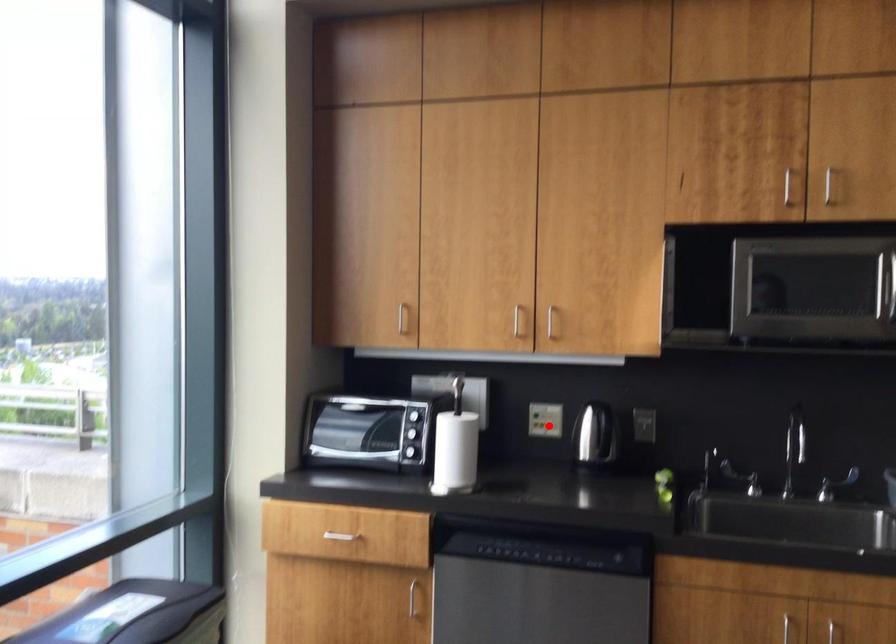
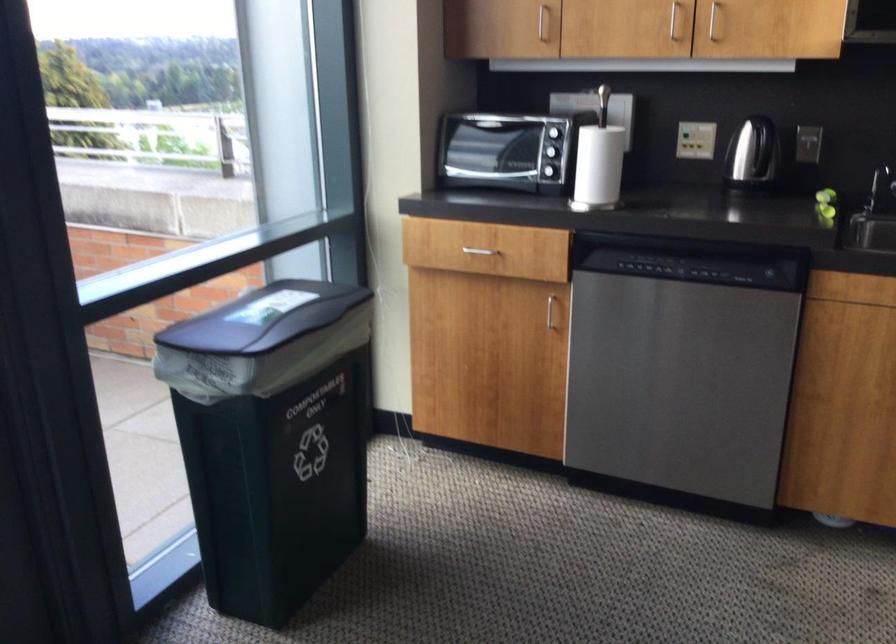
In the second image, find the point that corresponds to the highlighted location in the first image.

(695, 140)